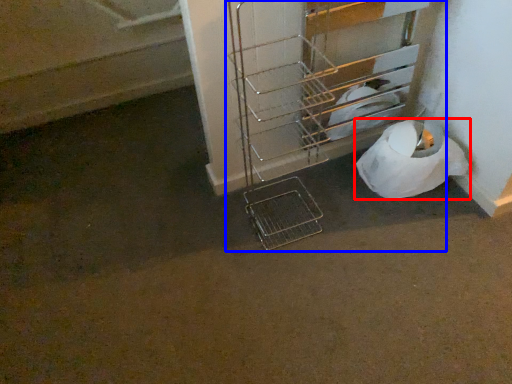
Question: Which of the following is the farthest to the observer, toilet paper (highlighted by a red box) or trolley (highlighted by a blue box)?

Choices:
 (A) toilet paper
 (B) trolley

Answer: (A)